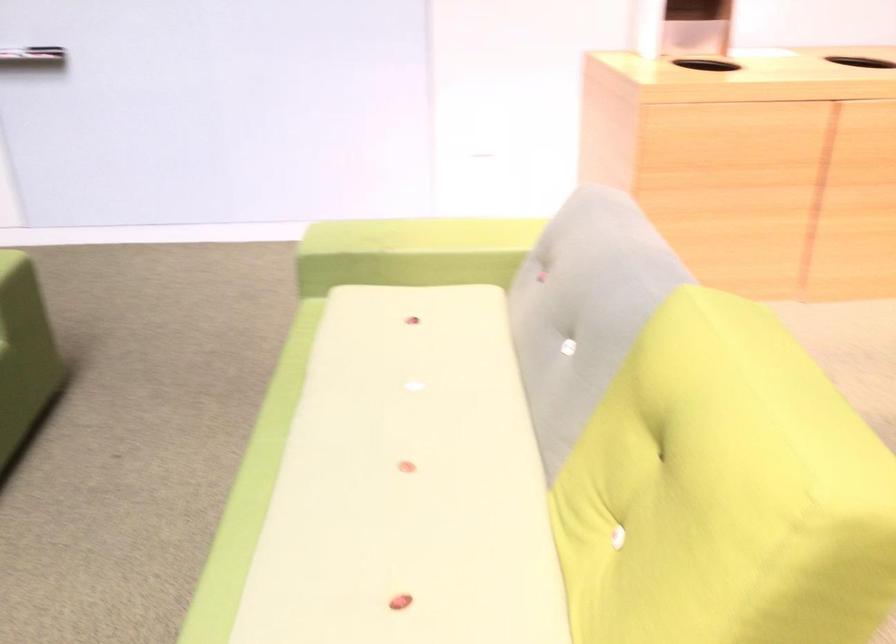
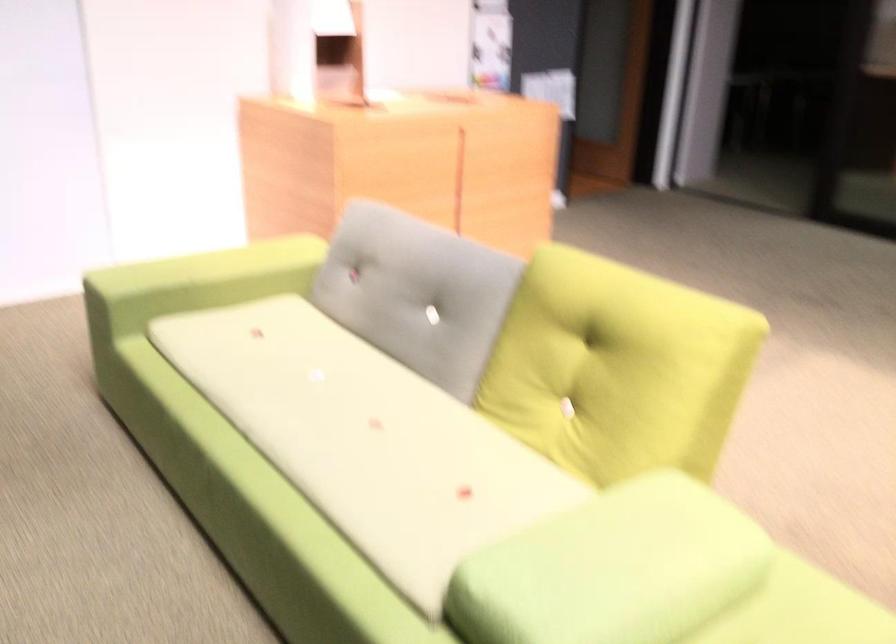
Locate, in the second image, the point that corresponds to (x=375, y=261) in the first image.

(194, 283)